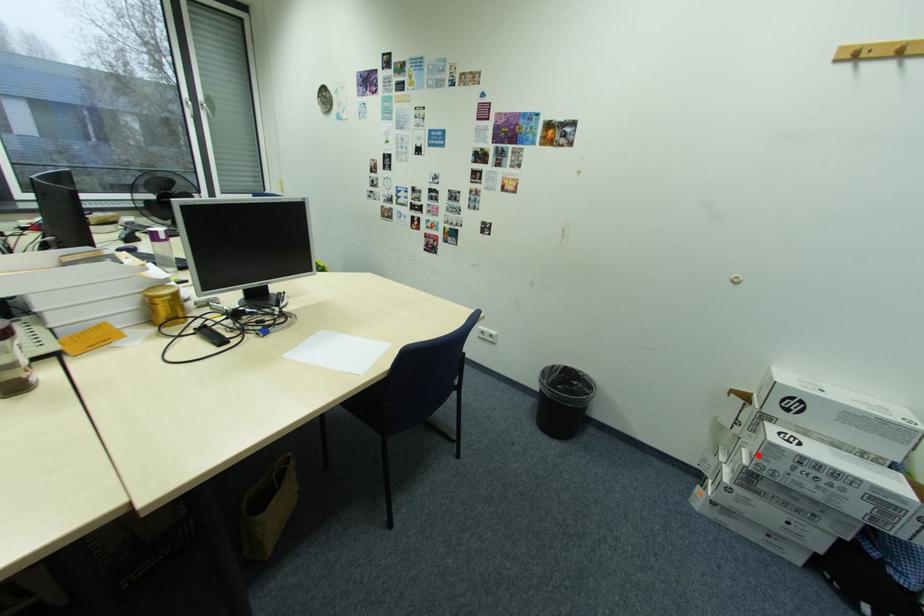
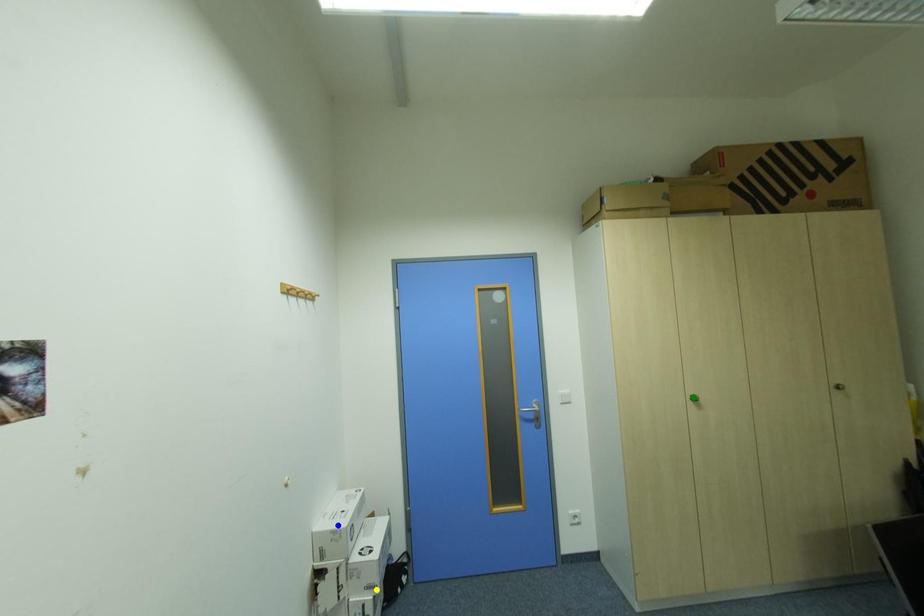
Question: I am providing you with two images of the same scene from different viewpoints. A red point is marked on the first image. You are given multiple points on the second image. Which mark in image 2 goes with the point in image 1?

Choices:
 (A) yellow point
 (B) green point
 (C) blue point

Answer: (A)